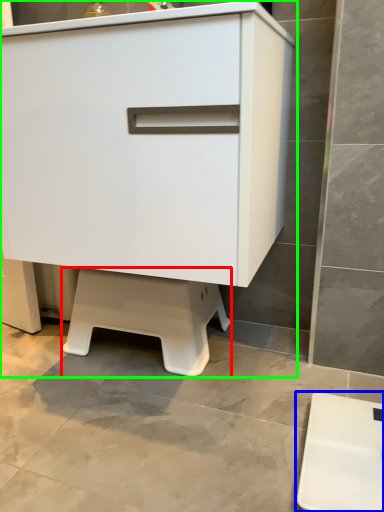
Question: Considering the real-world distances, which object is closest to step stool (highlighted by a red box)? furniture (highlighted by a blue box) or chest of drawers (highlighted by a green box).

Choices:
 (A) furniture
 (B) chest of drawers

Answer: (B)